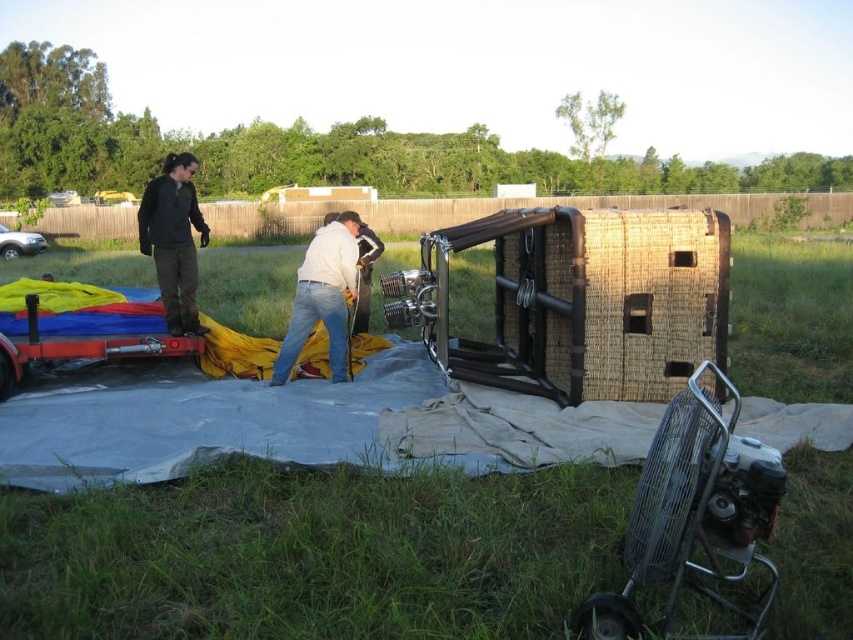
Who is positioned more to the left, silver metallic car at left or metallic silver car at upper left?

Positioned to the left is metallic silver car at upper left.

Does point (22, 252) come in front of point (73, 198)?

Yes, point (22, 252) is in front of point (73, 198).

Identify the location of silver metallic car at left. The width and height of the screenshot is (853, 640). (19, 243).

Describe the element at coordinates (693, 515) in the screenshot. The height and width of the screenshot is (640, 853). I see `metallic silver fan at lower right` at that location.

Is metallic silver fan at lower right above white cotton shirt at center?

No.

The width and height of the screenshot is (853, 640). In order to click on metallic silver fan at lower right in this screenshot , I will do `click(693, 515)`.

The image size is (853, 640). What do you see at coordinates (693, 515) in the screenshot?
I see `metallic silver fan at lower right` at bounding box center [693, 515].

Between point (737, 467) and point (175, 288), which one is positioned in front?

Positioned in front is point (737, 467).

Is point (722, 515) farther from viewer compared to point (158, 188)?

No, it is not.

Locate an element on the screen. metallic silver fan at lower right is located at coordinates (693, 515).